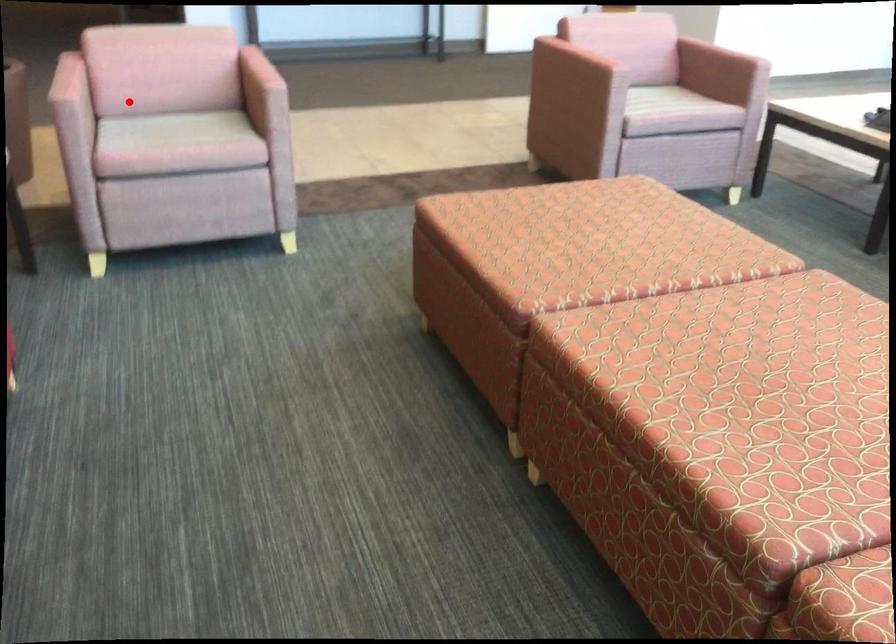
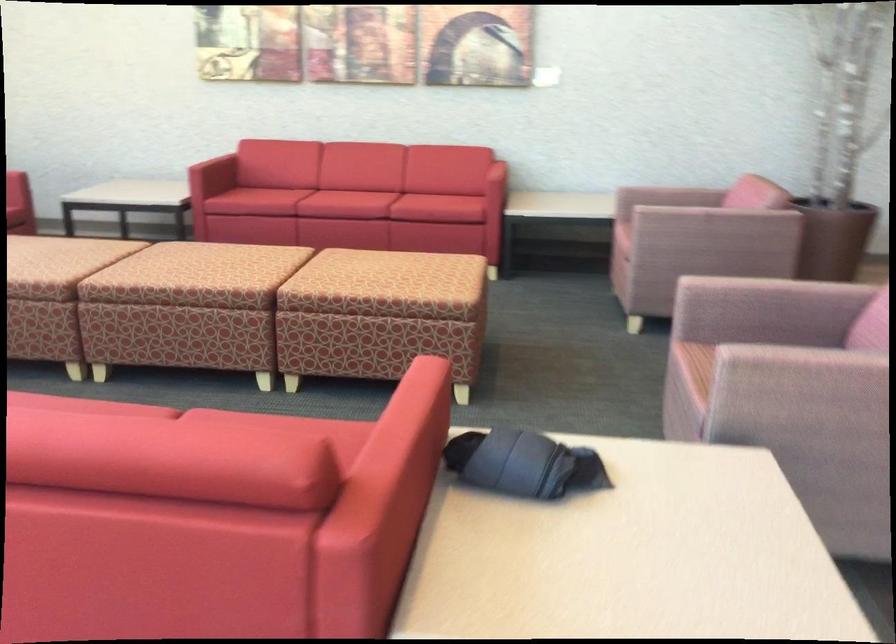
Question: I am providing you with two images of the same scene from different viewpoints. Image1 has a red point marked. In image2, the corresponding 3D location appears at what relative position? Reply with the corresponding letter.

Choices:
 (A) Closer
 (B) Farther

Answer: (B)